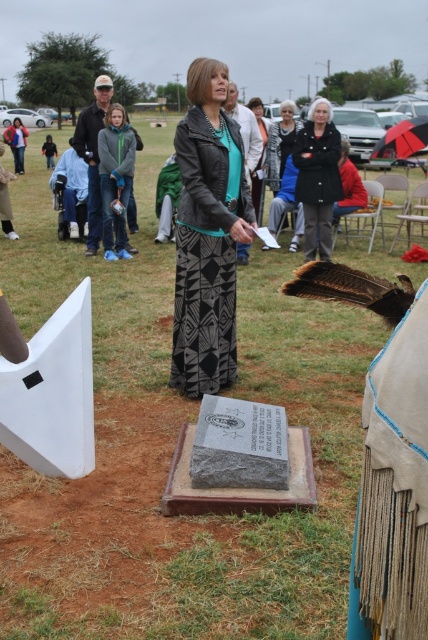
You are organizing a photo shoot and need to ensure that the matte black leather jacket at center and the black textured coat at center are both visible in the frame. Given their sizes, which one might require more space in the composition to accommodate its size?

The matte black leather jacket at center is larger in size than the black textured coat at center, so it would require more space in the composition to accommodate its size.

You are a photographer trying to capture the matte black leather jacket at center in your shot. The camera is positioned at point A. You want to move your camera to point B so that the jacket is centered in the frame. Which direction should you move the camera from point A to point B?

The matte black leather jacket at center is located at coordinates point (x=208, y=234). To center it in the frame, move the camera slightly to the right and down.

You are a photographer positioned at the center of the scene. You want to capture a photo where both the point at coordinates point[231,323] and point[119,120] are clearly visible. Based on their positions, which point is closer to your camera lens?

Point[231,323] is closer to the camera than point[119,120], so it will appear larger in the photo.